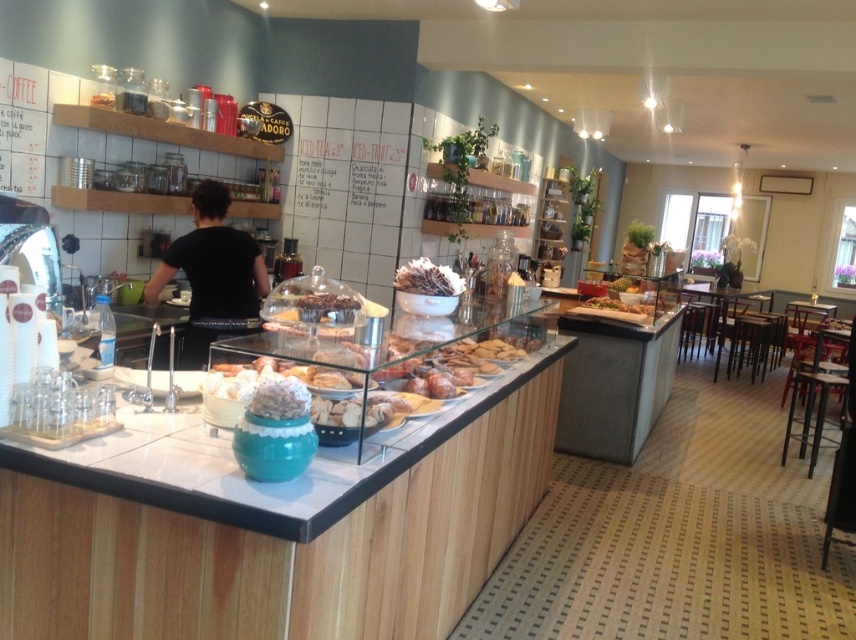
You are standing in the bakery and want to order a pastry. The counter is 10 feet away from you. Is the black fabric shirt at center closer to you than the counter?

The black fabric shirt at center is 12.43 feet away from the viewer, which is farther than the counter at 10 feet. Therefore, the counter is closer to you than the black fabric shirt at center.

You are a customer standing in front of the wooden counter top at center in the bakery. You want to grab a pastry from the display case without leaning over the counter. Can you reach it comfortably?

The wooden counter top at center is 1.47 meters away from the viewer. Since the counter has a glass display case, you should be able to reach the pastry comfortably without leaning over.